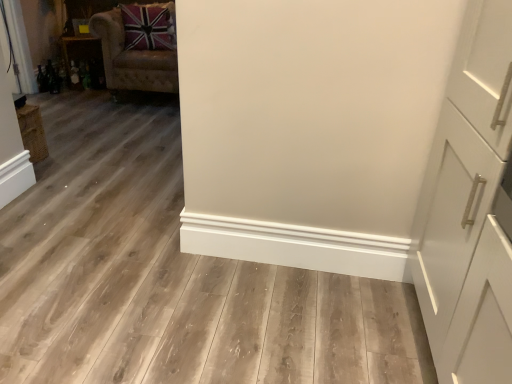
Measure the distance between point [120,26] and camera.

Point [120,26] and camera are 3.94 meters apart.

The height and width of the screenshot is (384, 512). What do you see at coordinates (138, 47) in the screenshot?
I see `velvet beige armchair at upper left` at bounding box center [138, 47].

You are a GUI agent. You are given a task and a screenshot of the screen. Output one action in this format:
    pyautogui.click(x=<x>, y=<y>)
    Task: Click on the velvet beige armchair at upper left
    
    Given the screenshot: What is the action you would take?
    pyautogui.click(x=138, y=47)

Describe the element at coordinates (73, 42) in the screenshot. The height and width of the screenshot is (384, 512). I see `wooden shelf at left` at that location.

The image size is (512, 384). Find the location of `wooden shelf at left`. wooden shelf at left is located at coordinates (73, 42).

The width and height of the screenshot is (512, 384). Identify the location of velvet beige armchair at upper left. (138, 47).

Considering the relative positions of wooden shelf at left and velvet beige armchair at upper left in the image provided, is wooden shelf at left to the left of velvet beige armchair at upper left from the viewer's perspective?

Yes.

Is wooden shelf at left closer to camera compared to velvet beige armchair at upper left?

No, the depth of wooden shelf at left is greater than that of velvet beige armchair at upper left.

Is point (65, 66) less distant than point (117, 45)?

No, (65, 66) is further to viewer.

From the image's perspective, is wooden shelf at left located above or below velvet beige armchair at upper left?

wooden shelf at left is situated higher than velvet beige armchair at upper left in the image.

From a real-world perspective, who is located higher, wooden shelf at left or velvet beige armchair at upper left?

velvet beige armchair at upper left, from a real-world perspective.

Is wooden shelf at left wider than velvet beige armchair at upper left?

No, wooden shelf at left is not wider than velvet beige armchair at upper left.

Between wooden shelf at left and velvet beige armchair at upper left, which one has more height?

With more height is velvet beige armchair at upper left.

Between wooden shelf at left and velvet beige armchair at upper left, which one has smaller size?

wooden shelf at left.

Would you say wooden shelf at left is inside or outside velvet beige armchair at upper left?

The correct answer is: outside.

Is there a large distance between wooden shelf at left and velvet beige armchair at upper left?

wooden shelf at left is near velvet beige armchair at upper left, not far away.

Is wooden shelf at left aimed at velvet beige armchair at upper left?

Yes, wooden shelf at left is turned towards velvet beige armchair at upper left.

Can you tell me how much wooden shelf at left and velvet beige armchair at upper left differ in facing direction?

They differ by 34.9 degrees in their facing directions.

Measure the distance between wooden shelf at left and velvet beige armchair at upper left.

wooden shelf at left is 28.07 inches away from velvet beige armchair at upper left.

What are the coordinates of `cabinetry located above the velvet beige armchair at upper left (from the image's perspective)` in the screenshot? It's located at (73, 42).

Which is more to the right, velvet beige armchair at upper left or wooden shelf at left?

From the viewer's perspective, velvet beige armchair at upper left appears more on the right side.

Which object is closer to the camera taking this photo, velvet beige armchair at upper left or wooden shelf at left?

velvet beige armchair at upper left is in front.

Which is in front, point (120, 26) or point (68, 57)?

The point (120, 26) is more forward.

From the image's perspective, which is below, velvet beige armchair at upper left or wooden shelf at left?

velvet beige armchair at upper left is shown below in the image.

From a real-world perspective, between velvet beige armchair at upper left and wooden shelf at left, who is vertically higher?

velvet beige armchair at upper left.

Considering the sizes of velvet beige armchair at upper left and wooden shelf at left in the image, is velvet beige armchair at upper left wider or thinner than wooden shelf at left?

velvet beige armchair at upper left is wider than wooden shelf at left.

Can you confirm if velvet beige armchair at upper left is shorter than wooden shelf at left?

Incorrect, the height of velvet beige armchair at upper left does not fall short of that of wooden shelf at left.

Can you confirm if velvet beige armchair at upper left is bigger than wooden shelf at left?

Yes, velvet beige armchair at upper left is bigger than wooden shelf at left.

Can we say velvet beige armchair at upper left lies outside wooden shelf at left?

velvet beige armchair at upper left lies outside wooden shelf at left's area.

Is velvet beige armchair at upper left beside wooden shelf at left?

velvet beige armchair at upper left and wooden shelf at left are not in contact.

Is velvet beige armchair at upper left turned away from wooden shelf at left?

No, velvet beige armchair at upper left's orientation is not away from wooden shelf at left.

Can you tell me how much velvet beige armchair at upper left and wooden shelf at left differ in facing direction?

The angular difference between velvet beige armchair at upper left and wooden shelf at left is 34.9 degrees.

This screenshot has width=512, height=384. Identify the location of chair that appears in front of the wooden shelf at left. (138, 47).

This screenshot has height=384, width=512. Find the location of `cabinetry that appears on the left of velvet beige armchair at upper left`. cabinetry that appears on the left of velvet beige armchair at upper left is located at coordinates (73, 42).

In the image, there is a velvet beige armchair at upper left. Identify the location of cabinetry above it (from the image's perspective). (73, 42).